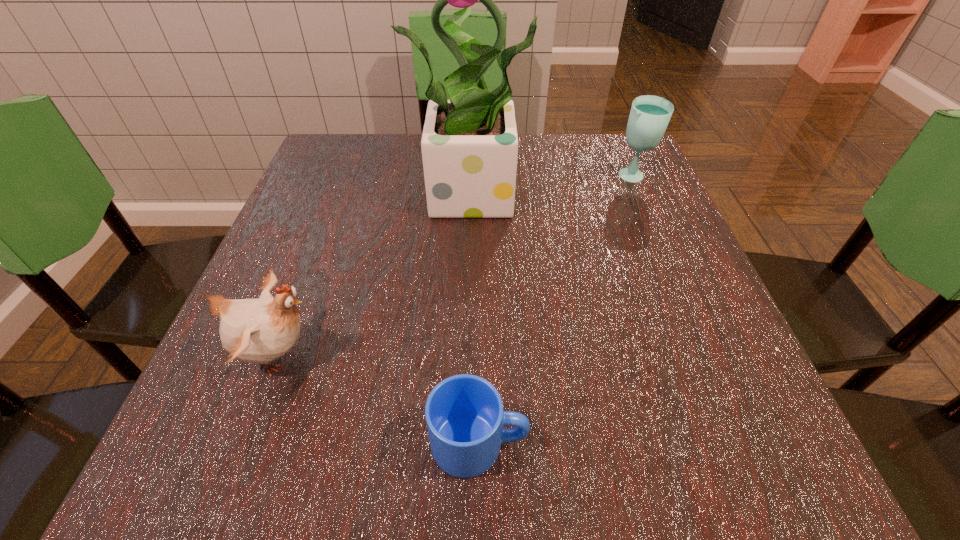
You are a GUI agent. You are given a task and a screenshot of the screen. Output one action in this format:
    pyautogui.click(x=<x>, y=<y>)
    Task: Click on the object at the near edge
    Image resolution: width=960 pixels, height=540 pixels.
    Given the screenshot: What is the action you would take?
    pyautogui.click(x=464, y=414)

Image resolution: width=960 pixels, height=540 pixels. I want to click on object at the left edge, so click(x=258, y=331).

The image size is (960, 540). In order to click on object present at the right edge in this screenshot , I will do `click(649, 116)`.

What are the coordinates of `object present at the far right corner` in the screenshot? It's located at (649, 116).

Locate an element on the screen. This screenshot has width=960, height=540. free space at the far edge of the desktop is located at coordinates (549, 146).

In order to click on vacant space at the left edge in this screenshot , I will do `click(356, 197)`.

In order to click on blank space at the right edge of the desktop in this screenshot , I will do `click(603, 210)`.

In the image, there is a desktop. At what (x,y) coordinates should I click in order to perform the action: click on vacant space at the far left corner. Please return your answer as a coordinate pair (x, y). Looking at the image, I should click on (328, 156).

At what (x,y) coordinates should I click in order to perform the action: click on vacant space at the far right corner. Please return your answer as a coordinate pair (x, y). This screenshot has height=540, width=960. Looking at the image, I should click on (612, 143).

Locate an element on the screen. The image size is (960, 540). vacant space at the near right corner of the desktop is located at coordinates (756, 446).